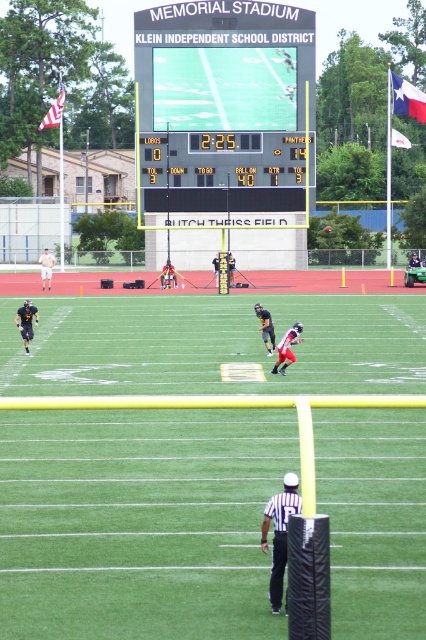
Question: Estimate the real-world distances between objects in this image. Which object is closer to the black jersey at center?

Choices:
 (A) black uniformed person at center
 (B) black uniformed player at center

Answer: (B)

Question: Can you confirm if metallic silver helmet at center is positioned to the left of dark blue uniform at center?

Choices:
 (A) no
 (B) yes

Answer: (B)

Question: Can you confirm if black digital scoreboard at center is positioned to the left of black jersey at center?

Choices:
 (A) no
 (B) yes

Answer: (B)

Question: Which point is closer to the camera taking this photo?

Choices:
 (A) (216, 620)
 (B) (416, 256)
 (C) (172, 273)
 (D) (213, 257)

Answer: (A)

Question: Does black uniform at left have a greater width compared to shiny black helmet at center?

Choices:
 (A) yes
 (B) no

Answer: (A)

Question: Which point appears closest to the camera in this image?

Choices:
 (A) pos(166,280)
 (B) pos(215,262)
 (C) pos(284,342)

Answer: (C)